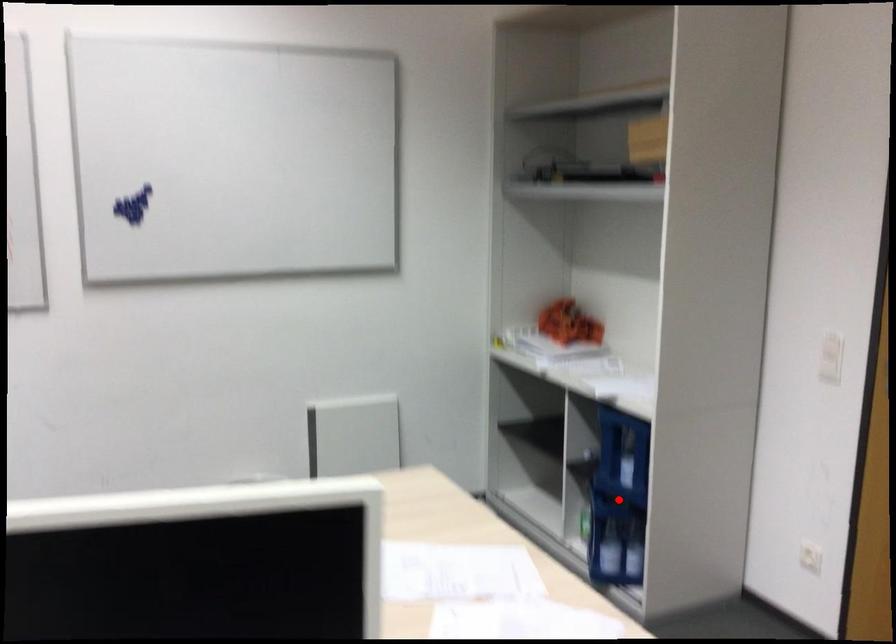
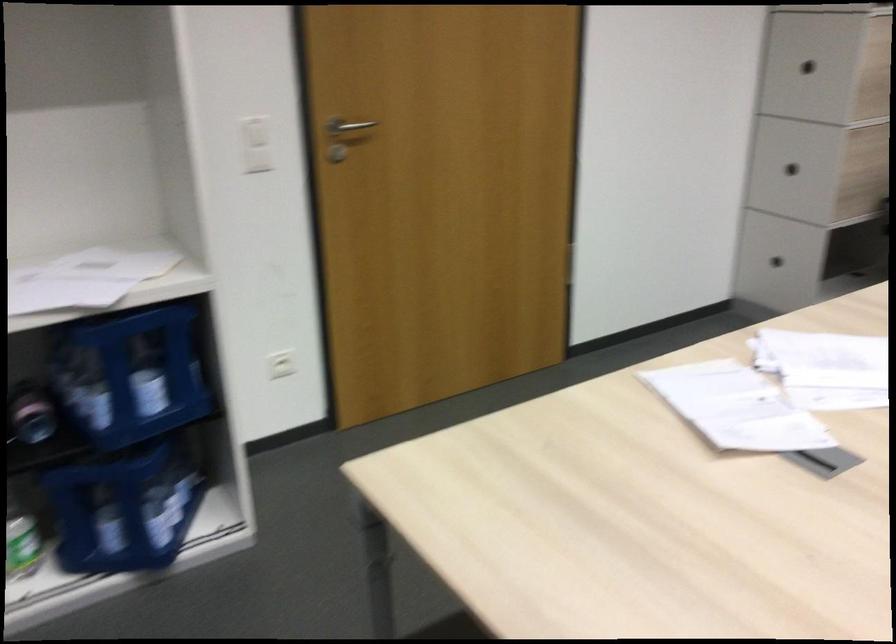
Question: I am providing you with two images of the same scene from different viewpoints. A red point is marked on the first image. Is the red point's position out of view in image 2?

Choices:
 (A) Yes
 (B) No

Answer: (A)